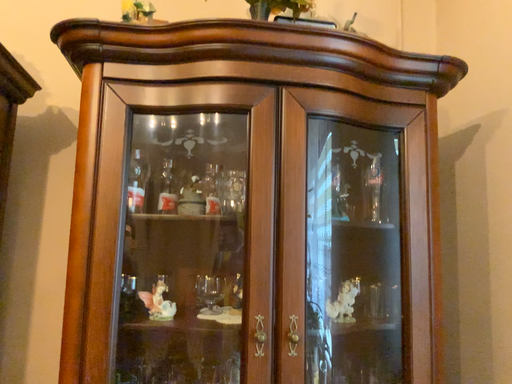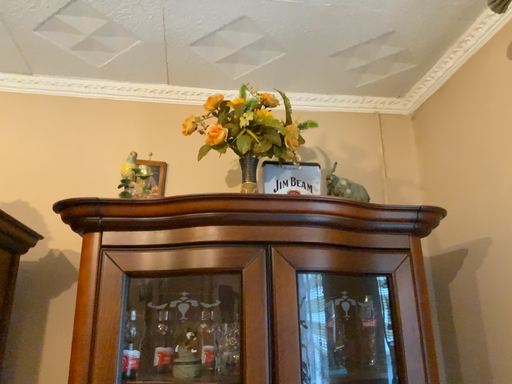
Question: Which way did the camera rotate in the video?

Choices:
 (A) rotated downward
 (B) rotated upward

Answer: (B)